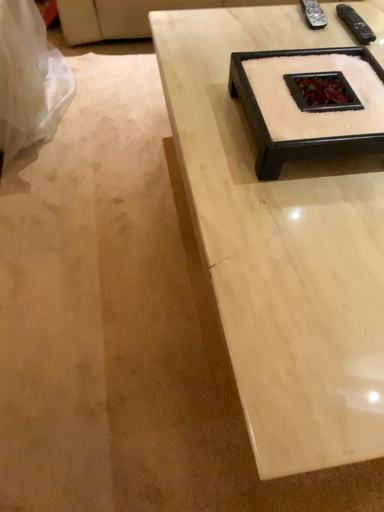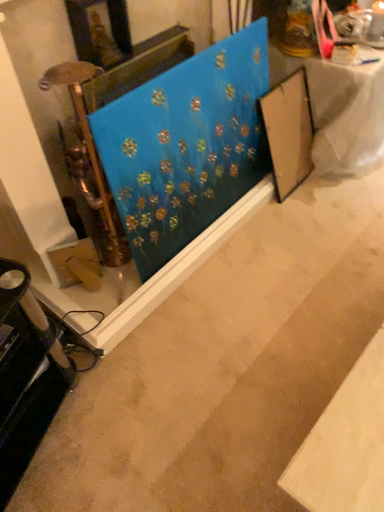
Question: Which way did the camera rotate in the video?

Choices:
 (A) rotated right
 (B) rotated left

Answer: (B)